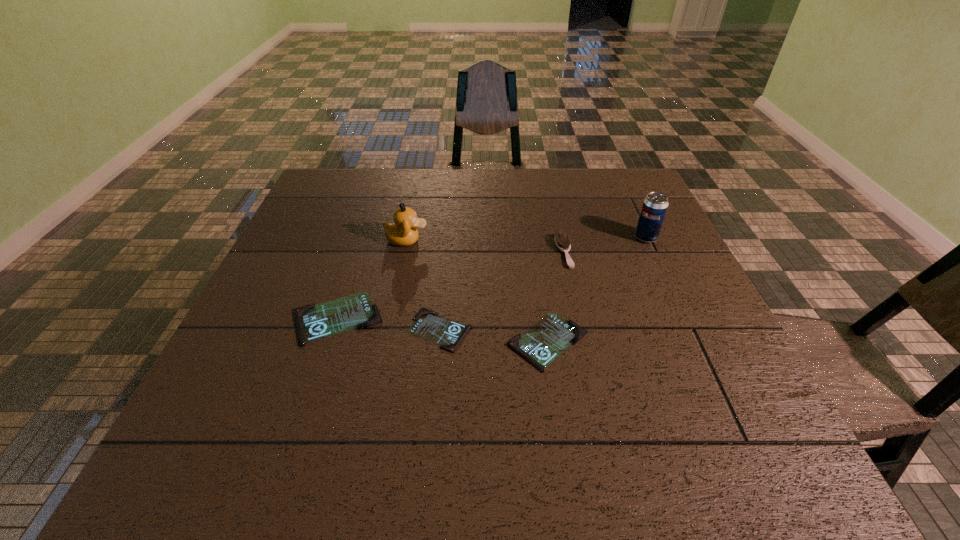
Identify the location of unoccupied position between the fourth shortest object and the duckling. This screenshot has height=540, width=960. (486, 246).

Locate an element on the screen. object that can be found as the fifth closest to the duckling is located at coordinates (653, 211).

Point out which object is positioned as the third nearest to the fifth tallest object. Please provide its 2D coordinates. Your answer should be formatted as a tuple, i.e. [(x, y)], where the tuple contains the x and y coordinates of a point satisfying the conditions above.

[(314, 322)]

Where is `identity card that is the second closest one to the second identity card from left to right`? identity card that is the second closest one to the second identity card from left to right is located at coordinates (543, 342).

Identify which identity card is located as the third nearest to the beer can. Please provide its 2D coordinates. Your answer should be formatted as a tuple, i.e. [(x, y)], where the tuple contains the x and y coordinates of a point satisfying the conditions above.

[(314, 322)]

Locate an element on the screen. free space that satisfies the following two spatial constraints: 1. on the face of the third tallest object; 2. on the right side of the duckling is located at coordinates (x=404, y=252).

At what (x,y) coordinates should I click in order to perform the action: click on vacant area in the image that satisfies the following two spatial constraints: 1. on the front side of the second shortest object; 2. on the right side of the leftmost identity card. Please return your answer as a coordinate pair (x, y). The width and height of the screenshot is (960, 540). Looking at the image, I should click on (329, 342).

I want to click on blank space that satisfies the following two spatial constraints: 1. on the face of the duckling; 2. on the back side of the second identity card from left to right, so tap(389, 330).

Identify the location of vacant region that satisfies the following two spatial constraints: 1. on the face of the shortest object; 2. on the left side of the duckling. The width and height of the screenshot is (960, 540). (389, 330).

At what (x,y) coordinates should I click in order to perform the action: click on vacant space that satisfies the following two spatial constraints: 1. on the front side of the shortest object; 2. on the right side of the leftmost identity card. Please return your answer as a coordinate pair (x, y). The image size is (960, 540). Looking at the image, I should click on (334, 330).